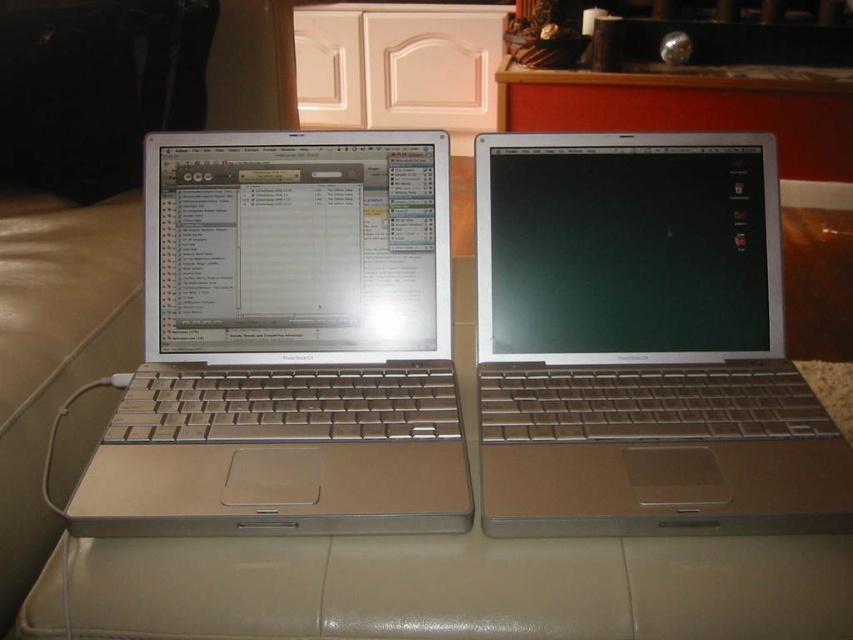
Does silver metallic laptop at left have a greater width compared to satin silver laptop at center?

Indeed, silver metallic laptop at left has a greater width compared to satin silver laptop at center.

Image resolution: width=853 pixels, height=640 pixels. Find the location of `silver metallic laptop at left`. silver metallic laptop at left is located at coordinates (288, 342).